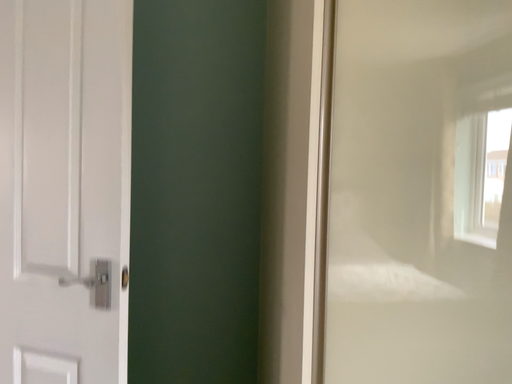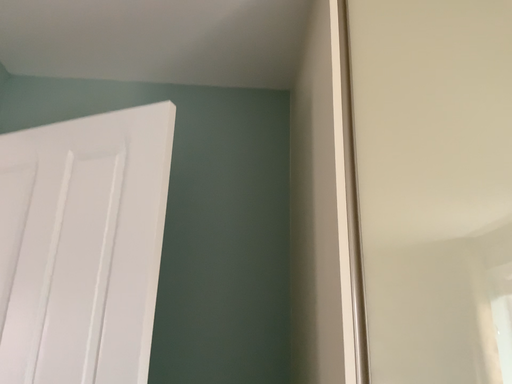
Question: Which way did the camera rotate in the video?

Choices:
 (A) rotated downward
 (B) rotated upward

Answer: (B)